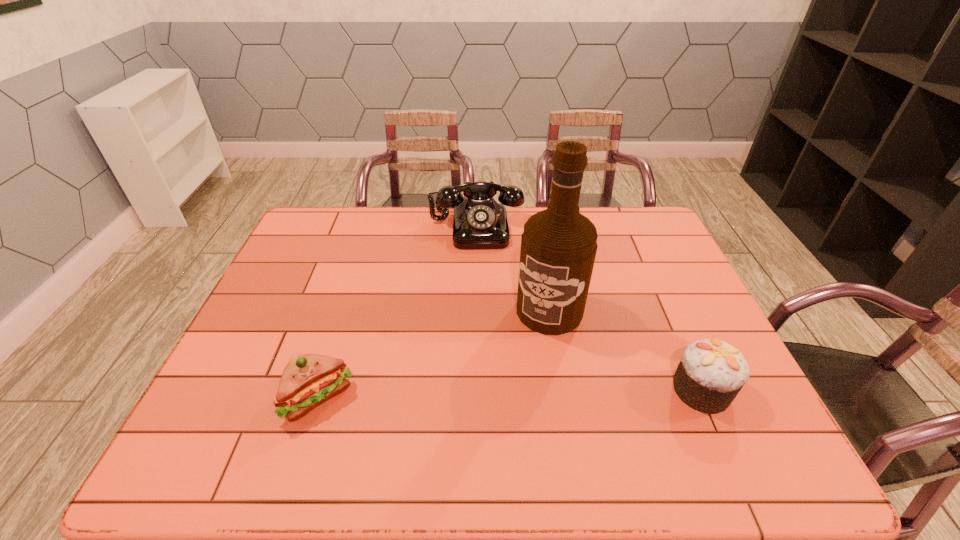
I want to click on vacant space on the desktop that is between the leftmost object and the cupcake and is positioned on the label of the alcohol, so click(503, 394).

The image size is (960, 540). In order to click on free space on the desktop that is between the sandwich and the rightmost object and is positioned on the dial of the telephone in this screenshot , I will do `click(483, 395)`.